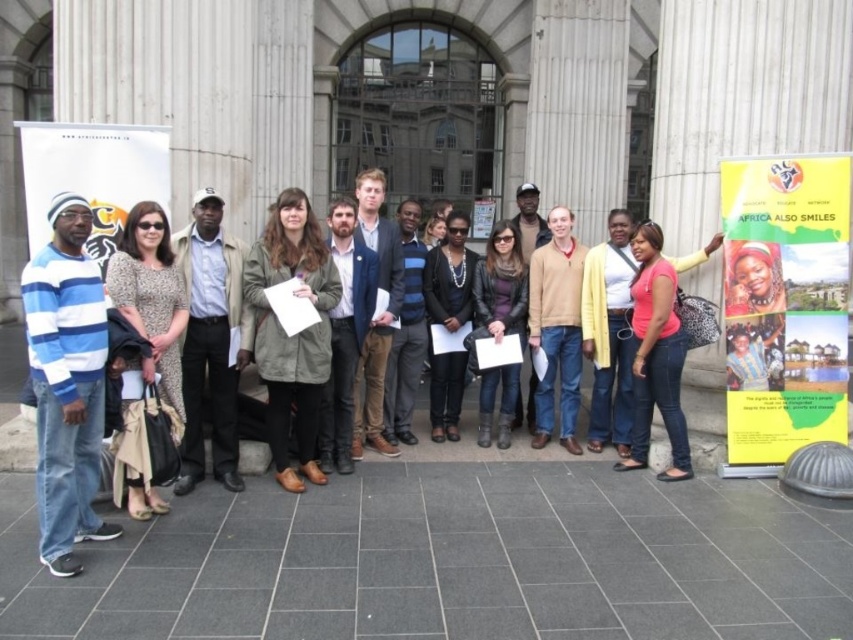
In the scene shown: You are a photographer adjusting your camera settings to capture the scene. You notice the yellow paper poster at center right and the tan sweater at center. Which object should you focus on first if you want to ensure both are in focus, considering their sizes in the frame?

The yellow paper poster at center right has a greater height compared to the tan sweater at center. Therefore, focusing on the larger object, the yellow paper poster at center right, will help ensure both are in focus since it requires a smaller aperture or a focus point that accommodates its size.

You are organizing an outdoor event and need to determine which of the two papers, the yellow paper poster at center right or the white paper at left, can be displayed in a frame that is 1.2 meters wide. Based on their sizes, which one is more likely to fit?

The yellow paper poster at center right has a lesser width compared to the white paper at left. Therefore, the yellow paper poster at center right is more likely to fit in the 1.2 meters wide frame since it is narrower than the white paper at left.

You are organizing a photo shoot and need to ensure that all elements are visible in the frame. Given the scene described, will the yellow paper poster at center right be fully visible alongside the tan sweater at center?

The yellow paper poster at center right has a smaller size compared to the tan sweater at center, so it should be fully visible alongside the tan sweater at center as long as the camera frame includes both central areas of the image.